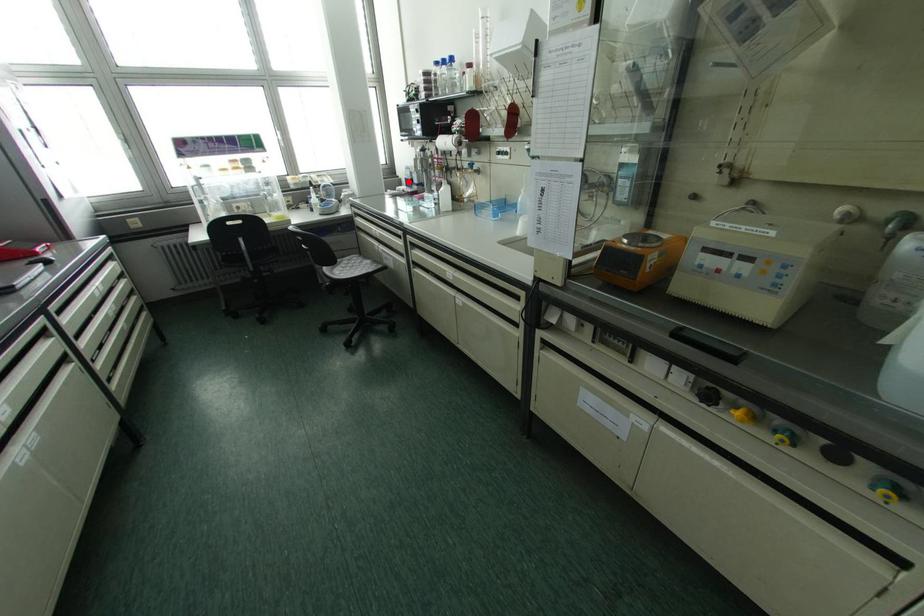
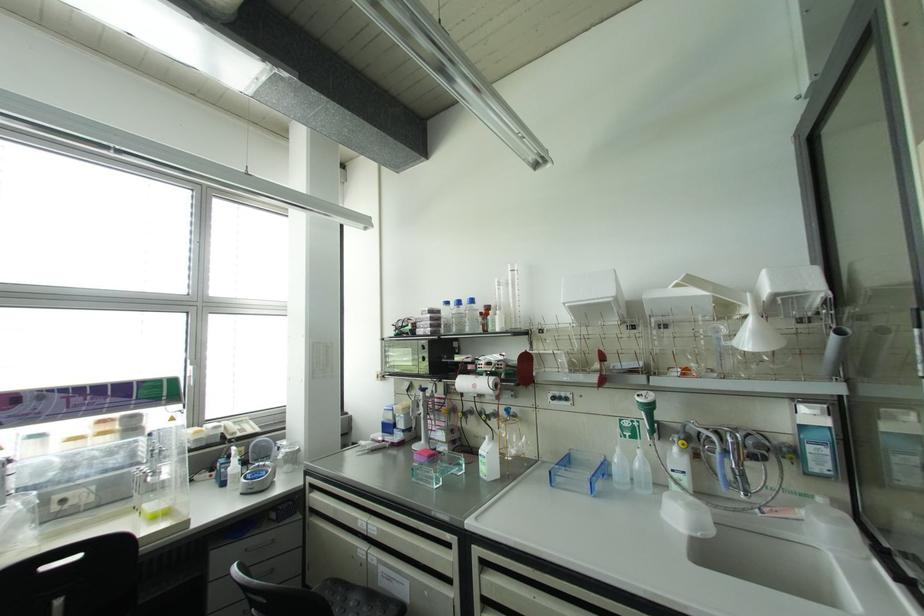
Question: A red point is marked in image1. In image2, is the corresponding 3D point closer to the camera or farther? Reply with the corresponding letter.

Choices:
 (A) The corresponding 3D point is closer.
 (B) The corresponding 3D point is farther.

Answer: (B)